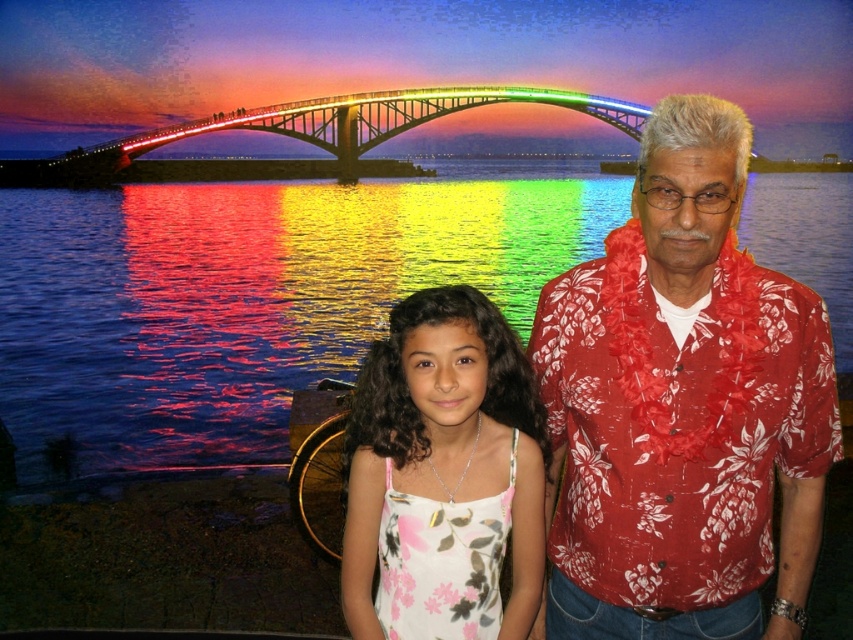
Is red floral shirt at right in front of white floral dress at center?

Yes, red floral shirt at right is in front of white floral dress at center.

Is point (674, 284) farther from camera compared to point (405, 470)?

No, it is not.

Does point (788, 497) come closer to viewer compared to point (506, 404)?

Yes, it is in front of point (506, 404).

At what (x,y) coordinates should I click in order to perform the action: click on red floral shirt at right. Please return your answer as a coordinate pair (x, y). Looking at the image, I should click on (682, 406).

Does glossy water at center lie in front of white floral dress at center?

No, it is not.

Can you confirm if glossy water at center is wider than white floral dress at center?

Correct, the width of glossy water at center exceeds that of white floral dress at center.

Who is more distant from viewer, (49, 376) or (434, 426)?

The point (49, 376) is more distant.

Locate an element on the screen. The image size is (853, 640). glossy water at center is located at coordinates (247, 300).

In the scene shown: Does glossy water at center have a lesser width compared to red floral shirt at right?

No.

What do you see at coordinates (247, 300) in the screenshot?
I see `glossy water at center` at bounding box center [247, 300].

Image resolution: width=853 pixels, height=640 pixels. In order to click on glossy water at center in this screenshot , I will do `click(247, 300)`.